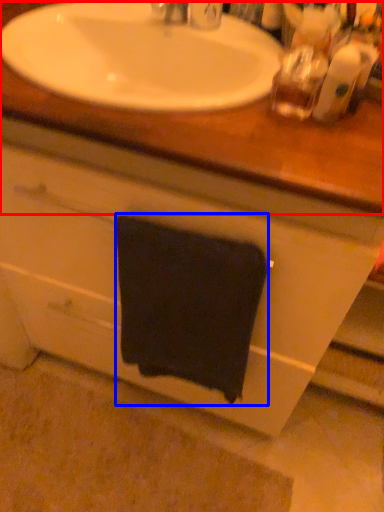
Question: Which point is further to the camera, counter top (highlighted by a red box) or towel/napkin (highlighted by a blue box)?

Choices:
 (A) counter top
 (B) towel/napkin

Answer: (B)